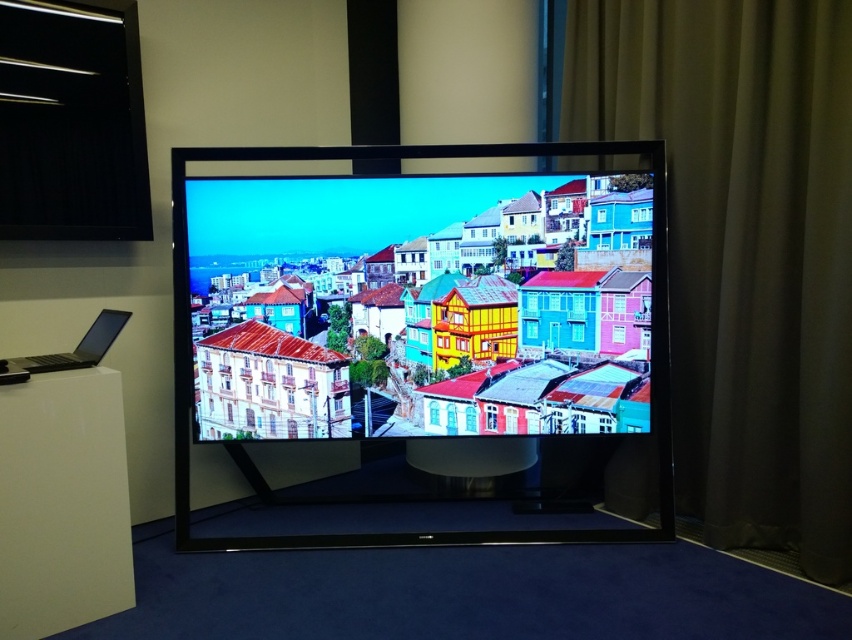
Question: Which of the following is the farthest from the observer?

Choices:
 (A) (81, 358)
 (B) (833, 451)
 (C) (340, 413)

Answer: (C)

Question: Is matte glass screen at center to the right of satin black laptop at lower left from the viewer's perspective?

Choices:
 (A) no
 (B) yes

Answer: (B)

Question: Which object is positioned farthest from the satin black laptop at lower left?

Choices:
 (A) matte glass screen at center
 (B) dark green fabric curtain at right

Answer: (B)

Question: Can you confirm if matte glass screen at center is smaller than satin black laptop at lower left?

Choices:
 (A) yes
 (B) no

Answer: (B)

Question: Among these objects, which one is farthest from the camera?

Choices:
 (A) dark green fabric curtain at right
 (B) matte glass screen at center
 (C) satin black laptop at lower left

Answer: (B)

Question: Does matte glass screen at center have a larger size compared to satin black laptop at lower left?

Choices:
 (A) no
 (B) yes

Answer: (B)